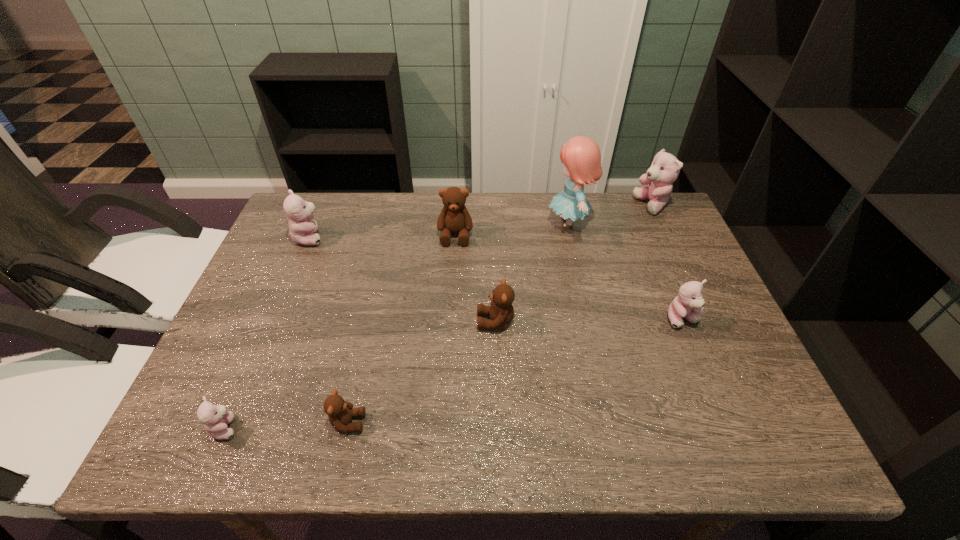
Identify which brown teddy bear is located as the nearest to the rightmost brown teddy bear. Please provide its 2D coordinates. Your answer should be formatted as a tuple, i.e. [(x, y)], where the tuple contains the x and y coordinates of a point satisfying the conditions above.

[(454, 218)]

I want to click on the closest brown teddy bear relative to the smallest brown teddy bear, so click(x=501, y=312).

Identify the location of free space that satisfies the following two spatial constraints: 1. on the front-facing side of the blue doll; 2. on the face of the biggest brown teddy bear. (571, 235).